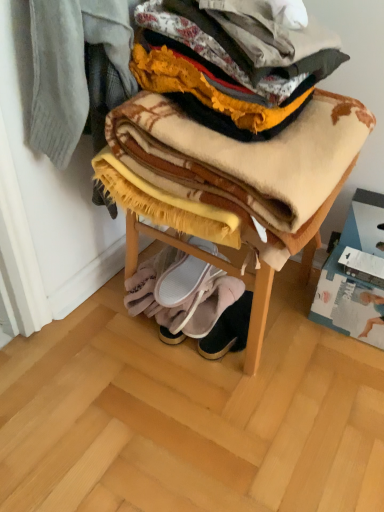
Locate an element on the screen. The image size is (384, 512). vacant region to the right of white fabric slipper at lower center, the second footwear viewed from the top is located at coordinates (288, 321).